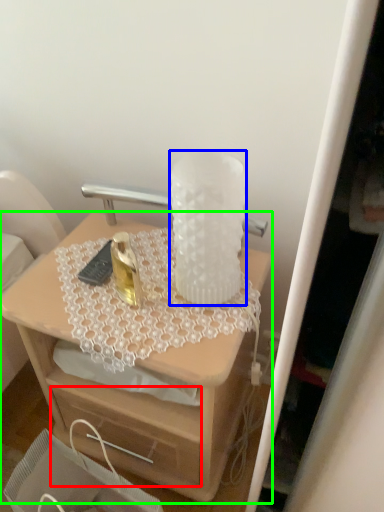
Question: Considering the real-world distances, which object is closest to drawer (highlighted by a red box)? vase (highlighted by a blue box) or desk (highlighted by a green box).

Choices:
 (A) vase
 (B) desk

Answer: (B)